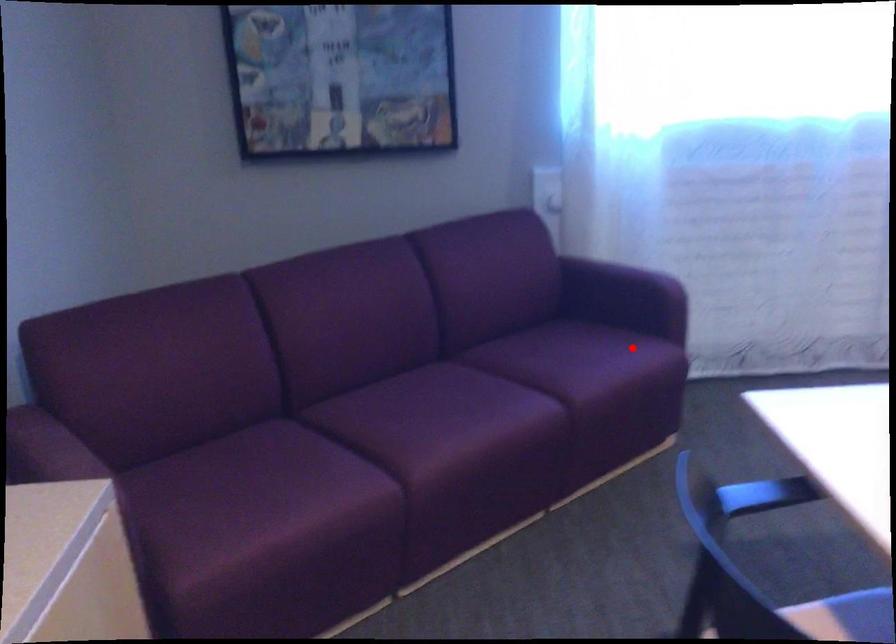
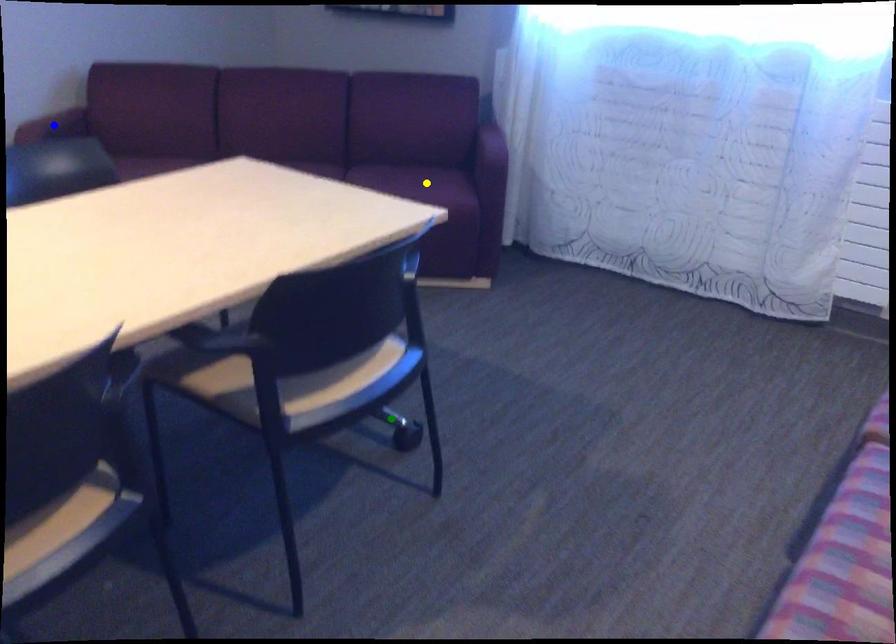
Question: I am providing you with two images of the same scene from different viewpoints. A red point is marked on the first image. You are given multiple points on the second image. Which point in image 2 is actually the same real-world point as the red point in image 1?

Choices:
 (A) yellow point
 (B) blue point
 (C) green point

Answer: (A)